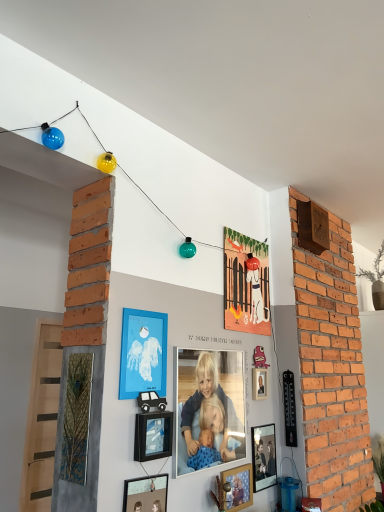
Question: Does wooden photo frame at lower center, placed as the third picture frame when sorted from back to front, come behind matte black picture frame at lower center, arranged as the 1th picture frame when viewed from the front?

Choices:
 (A) yes
 (B) no

Answer: (A)

Question: Does wooden photo frame at lower center, marked as the fourth picture frame in a front-to-back arrangement, have a larger size compared to matte black picture frame at lower center, acting as the sixth picture frame starting from the back?

Choices:
 (A) no
 (B) yes

Answer: (A)

Question: Considering the relative sizes of wooden photo frame at lower center, placed as the third picture frame when sorted from back to front, and matte black picture frame at lower center, acting as the sixth picture frame starting from the back, in the image provided, is wooden photo frame at lower center, placed as the third picture frame when sorted from back to front, wider than matte black picture frame at lower center, acting as the sixth picture frame starting from the back,?

Choices:
 (A) yes
 (B) no

Answer: (A)

Question: Does wooden photo frame at lower center, marked as the fourth picture frame in a front-to-back arrangement, turn towards matte black picture frame at lower center, acting as the sixth picture frame starting from the back?

Choices:
 (A) yes
 (B) no

Answer: (B)

Question: Is the depth of wooden photo frame at lower center, placed as the third picture frame when sorted from back to front, less than that of matte black picture frame at lower center, acting as the sixth picture frame starting from the back?

Choices:
 (A) yes
 (B) no

Answer: (B)

Question: In terms of width, does matte black picture frame at lower center, acting as the sixth picture frame starting from the back, look wider or thinner when compared to wooden photo frame at lower center, marked as the fourth picture frame in a front-to-back arrangement?

Choices:
 (A) wide
 (B) thin

Answer: (B)

Question: From the image's perspective, relative to wooden photo frame at lower center, placed as the third picture frame when sorted from back to front, is matte black picture frame at lower center, arranged as the 1th picture frame when viewed from the front, above or below?

Choices:
 (A) above
 (B) below

Answer: (A)

Question: Is matte black picture frame at lower center, acting as the sixth picture frame starting from the back, bigger or smaller than wooden photo frame at lower center, marked as the fourth picture frame in a front-to-back arrangement?

Choices:
 (A) big
 (B) small

Answer: (A)

Question: Is point (155, 479) positioned closer to the camera than point (238, 470)?

Choices:
 (A) farther
 (B) closer

Answer: (B)

Question: Is matte blue frame at center, which is the 3th picture frame from front to back, wider or thinner than matte black picture frame at lower center, acting as the sixth picture frame starting from the back?

Choices:
 (A) wide
 (B) thin

Answer: (B)

Question: From their relative heights in the image, would you say matte blue frame at center, which ranks as the 4th picture frame in back-to-front order, is taller or shorter than matte black picture frame at lower center, arranged as the 1th picture frame when viewed from the front?

Choices:
 (A) short
 (B) tall

Answer: (B)

Question: Is matte blue frame at center, which ranks as the 4th picture frame in back-to-front order, to the left or to the right of matte black picture frame at lower center, arranged as the 1th picture frame when viewed from the front, in the image?

Choices:
 (A) right
 (B) left

Answer: (B)

Question: Considering the positions of point (165, 333) and point (163, 509), is point (165, 333) closer or farther from the camera than point (163, 509)?

Choices:
 (A) farther
 (B) closer

Answer: (A)

Question: Relative to matte black picture frame at lower center, acting as the sixth picture frame starting from the back, is wooden photo frame at lower center, placed as the third picture frame when sorted from back to front, in front or behind?

Choices:
 (A) behind
 (B) front

Answer: (A)

Question: Would you say wooden photo frame at lower center, marked as the fourth picture frame in a front-to-back arrangement, is to the left or to the right of matte black picture frame at lower center, acting as the sixth picture frame starting from the back, in the picture?

Choices:
 (A) left
 (B) right

Answer: (B)